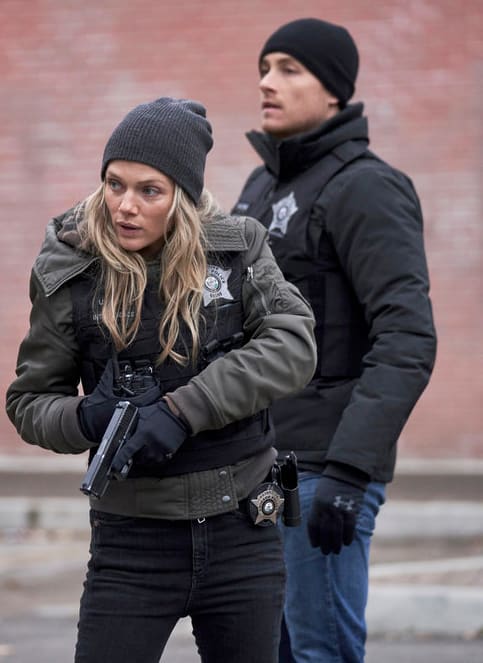
I want to click on red brick wall, so click(131, 48).